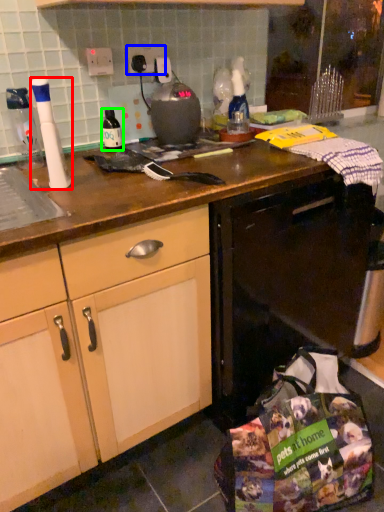
Question: Based on their relative distances, which object is nearer to kitchen appliance (highlighted by a red box)? Choose from electric outlet (highlighted by a blue box) and bottle (highlighted by a green box).

Choices:
 (A) electric outlet
 (B) bottle

Answer: (B)